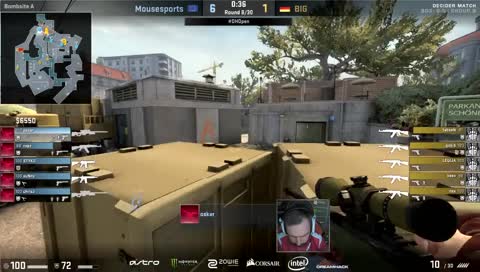
Image resolution: width=480 pixels, height=272 pixels. I want to click on door, so (x=123, y=129).